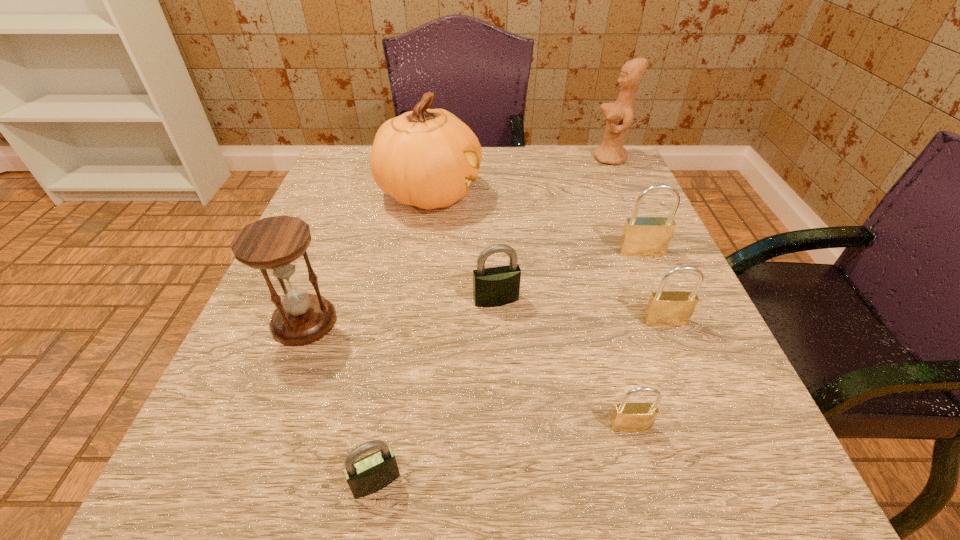
Locate an element on the screen. The image size is (960, 540). object that is at the far right corner is located at coordinates (618, 118).

This screenshot has height=540, width=960. Identify the location of vacant area at the far edge. (556, 164).

At what (x,y) coordinates should I click in order to perform the action: click on free spot at the near edge of the desktop. Please return your answer as a coordinate pair (x, y). Looking at the image, I should click on (525, 495).

The image size is (960, 540). In the image, there is a desktop. What are the coordinates of `vacant area at the left edge` in the screenshot? It's located at (319, 346).

Identify the location of vacant space at the right edge of the desktop. (704, 336).

Find the location of a particular element. This screenshot has width=960, height=540. vacant space at the near left corner of the desktop is located at coordinates (224, 465).

Where is `free space at the far right corner`? The width and height of the screenshot is (960, 540). free space at the far right corner is located at coordinates (573, 185).

At what (x,y) coordinates should I click in order to perform the action: click on vacant region between the fourth nearest padlock and the pumpkin. Please return your answer as a coordinate pair (x, y). The width and height of the screenshot is (960, 540). Looking at the image, I should click on (463, 247).

The image size is (960, 540). I want to click on empty space that is in between the nearest padlock and the third nearest padlock, so click(x=520, y=402).

Locate an element on the screen. This screenshot has height=540, width=960. vacant space in between the tallest padlock and the second farthest brass padlock is located at coordinates (653, 287).